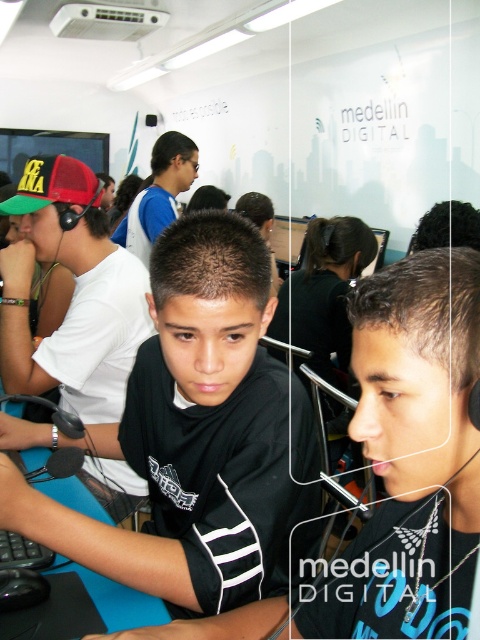
Question: Among these objects, which one is farthest from the camera?

Choices:
 (A) black matte shirt at center
 (B) black jersey at center

Answer: (A)

Question: Which point appears closest to the camera in this image?

Choices:
 (A) (348, 605)
 (B) (288, 499)

Answer: (A)

Question: In this image, where is black matte shirt at center located relative to black jersey at center?

Choices:
 (A) above
 (B) below

Answer: (A)

Question: Is black matte shirt at center thinner than black jersey at center?

Choices:
 (A) no
 (B) yes

Answer: (A)

Question: Is black matte shirt at center bigger than black jersey at center?

Choices:
 (A) yes
 (B) no

Answer: (A)